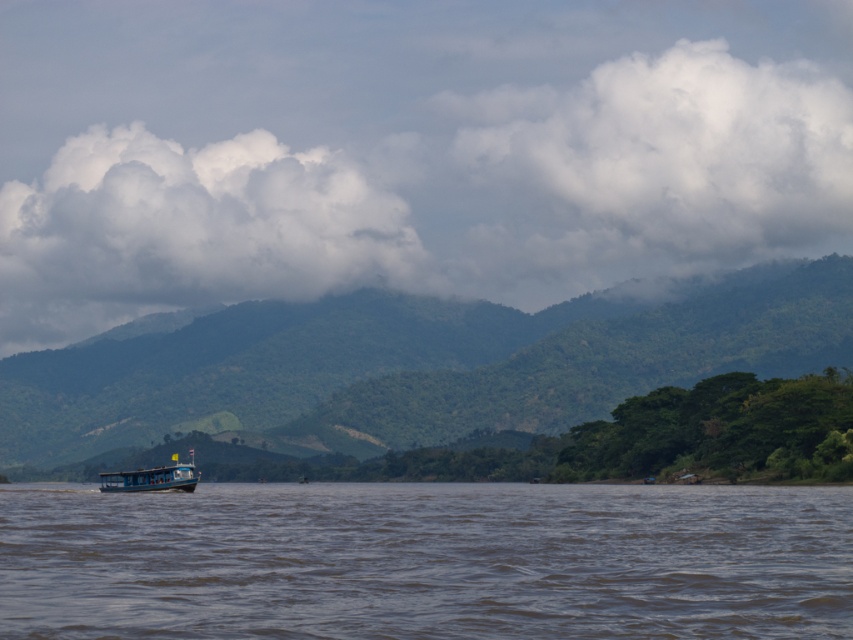
Is brown muddy water at lower center further to the viewer compared to blue wooden boat at center?

No, it is not.

Is brown muddy water at lower center above blue wooden boat at center?

No.

Where is `brown muddy water at lower center`? The height and width of the screenshot is (640, 853). brown muddy water at lower center is located at coordinates (426, 561).

Based on the photo, is green leafy forest at center closer to the viewer compared to blue wooden boat at center?

No, it is behind blue wooden boat at center.

Is green leafy forest at center to the right of blue wooden boat at center from the viewer's perspective?

Correct, you'll find green leafy forest at center to the right of blue wooden boat at center.

Is point (798, 310) farther from camera compared to point (113, 481)?

Yes, it is behind point (113, 481).

The width and height of the screenshot is (853, 640). Find the location of `green leafy forest at center`. green leafy forest at center is located at coordinates (415, 365).

Can you confirm if brown muddy water at lower center is bigger than green leafy forest at center?

Incorrect, brown muddy water at lower center is not larger than green leafy forest at center.

Is the position of brown muddy water at lower center more distant than that of green leafy forest at center?

No, it is in front of green leafy forest at center.

Is point (384, 509) less distant than point (15, 428)?

Yes, it is.

Identify the location of brown muddy water at lower center. This screenshot has width=853, height=640. (426, 561).